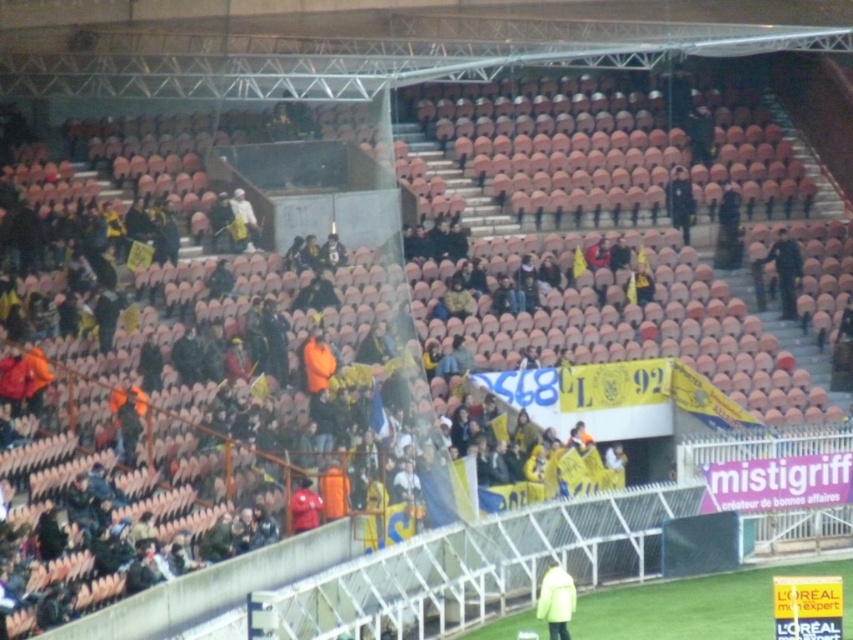
Question: Can you confirm if yellow matte jacket at center is bigger than black uniform at center?

Choices:
 (A) yes
 (B) no

Answer: (B)

Question: Can you confirm if yellow matte jacket at center is bigger than black uniform at center?

Choices:
 (A) no
 (B) yes

Answer: (A)

Question: Is yellow matte jacket at center to the right of black uniform at center from the viewer's perspective?

Choices:
 (A) no
 (B) yes

Answer: (A)

Question: Among these objects, which one is nearest to the camera?

Choices:
 (A) black uniform at center
 (B) yellow matte jacket at center

Answer: (B)